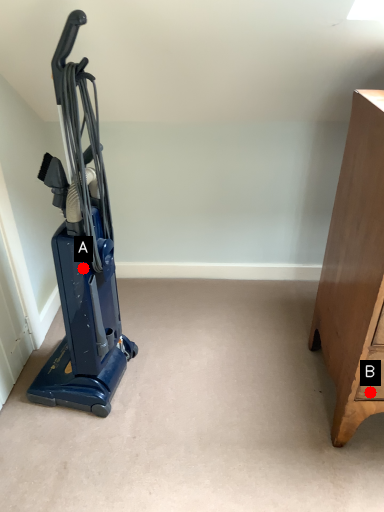
Question: Two points are circled on the image, labeled by A and B beside each circle. Which point is closer to the camera?

Choices:
 (A) A is closer
 (B) B is closer

Answer: (A)